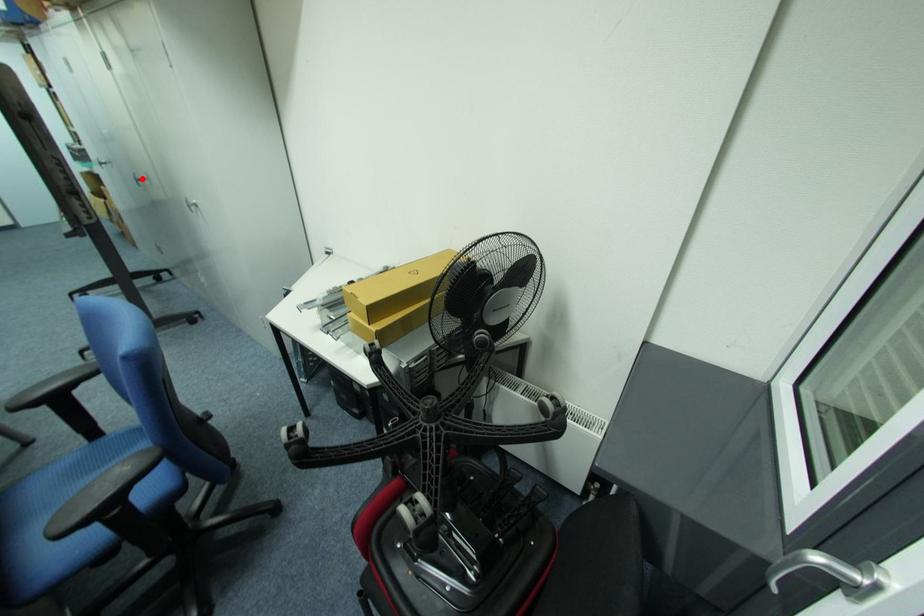
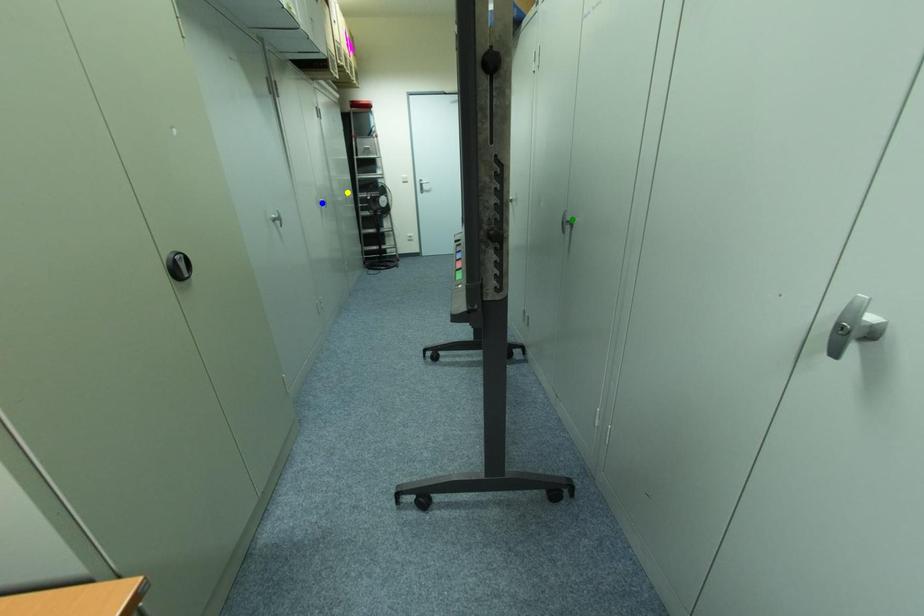
Question: I am providing you with two images of the same scene from different viewpoints. A red point is marked on the first image. You are given multiple points on the second image. Which point in image 2 represents the same 3d spot as the red point in image 1?

Choices:
 (A) blue point
 (B) yellow point
 (C) green point

Answer: (C)